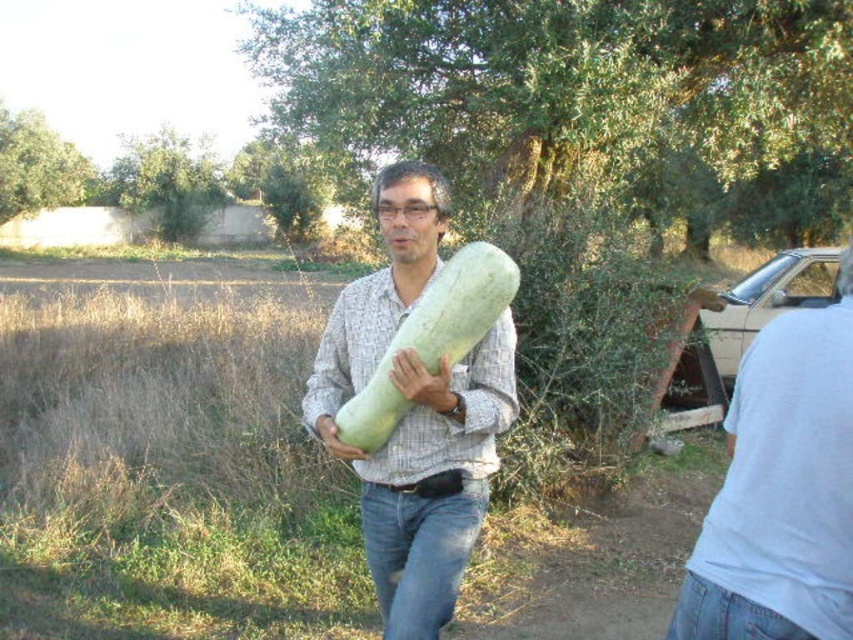
Question: Which object appears farthest from the camera in this image?

Choices:
 (A) green matte cucumber at center
 (B) green matte squash at center

Answer: (B)

Question: Is green matte cucumber at center behind beige metallic car at right?

Choices:
 (A) yes
 (B) no

Answer: (B)

Question: Is white matte shirt at right further to the viewer compared to smooth green squash at center?

Choices:
 (A) yes
 (B) no

Answer: (B)

Question: Which point is farther to the camera?

Choices:
 (A) green matte squash at center
 (B) smooth green squash at center
 (C) white matte shirt at right

Answer: (B)

Question: Which point is farther to the camera?

Choices:
 (A) smooth green squash at center
 (B) green matte squash at center

Answer: (A)

Question: Can you confirm if white matte shirt at right is positioned to the left of green matte cucumber at center?

Choices:
 (A) no
 (B) yes

Answer: (A)